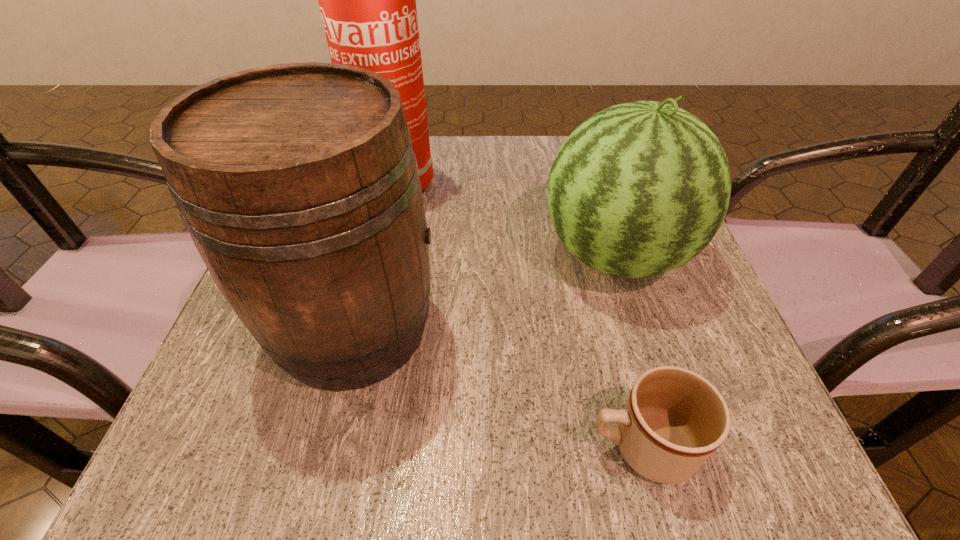
You are a GUI agent. You are given a task and a screenshot of the screen. Output one action in this format:
    pyautogui.click(x=<x>, y=<y>)
    Task: Click on the vacant region that satisfies the following two spatial constraints: 1. on the side of the shortest object with the handle; 2. at the nozzle of the farthest object
    This screenshot has width=960, height=540.
    Given the screenshot: What is the action you would take?
    pyautogui.click(x=574, y=185)

Locate an element on the screen. This screenshot has height=540, width=960. vacant space that satisfies the following two spatial constraints: 1. on the side of the second shortest object with the handle; 2. on the left side of the shortest object is located at coordinates (592, 255).

Where is `free region that satisfies the following two spatial constraints: 1. on the side of the mug with the handle; 2. at the nozzle of the tallest object`? Image resolution: width=960 pixels, height=540 pixels. free region that satisfies the following two spatial constraints: 1. on the side of the mug with the handle; 2. at the nozzle of the tallest object is located at coordinates (574, 185).

Find the location of `free location that satisfies the following two spatial constraints: 1. on the side of the watermelon with the handle; 2. on the right side of the mug`. free location that satisfies the following two spatial constraints: 1. on the side of the watermelon with the handle; 2. on the right side of the mug is located at coordinates (592, 255).

At what (x,y) coordinates should I click in order to perform the action: click on vacant space that satisfies the following two spatial constraints: 1. on the back side of the watermelon; 2. at the nozzle of the farthest object. Please return your answer as a coordinate pair (x, y). Image resolution: width=960 pixels, height=540 pixels. Looking at the image, I should click on (593, 185).

The width and height of the screenshot is (960, 540). I want to click on vacant space that satisfies the following two spatial constraints: 1. on the side of the mug with the handle; 2. at the nozzle of the fire extinguisher, so click(x=574, y=185).

This screenshot has width=960, height=540. In order to click on vacant space that satisfies the following two spatial constraints: 1. on the side of the nearest object with the handle; 2. on the side of the cider near the bung hole in this screenshot , I will do [x=611, y=328].

Where is `vacant space that satisfies the following two spatial constraints: 1. at the nozzle of the tallest object; 2. on the side of the mug with the handle`? vacant space that satisfies the following two spatial constraints: 1. at the nozzle of the tallest object; 2. on the side of the mug with the handle is located at coordinates coord(309,446).

At what (x,y) coordinates should I click in order to perform the action: click on free location that satisfies the following two spatial constraints: 1. on the back side of the second shortest object; 2. at the nozzle of the tallest object. Please return your answer as a coordinate pair (x, y). Looking at the image, I should click on (593, 185).

Locate an element on the screen. vacant space that satisfies the following two spatial constraints: 1. on the side of the watermelon with the handle; 2. on the left side of the nearest object is located at coordinates (592, 255).